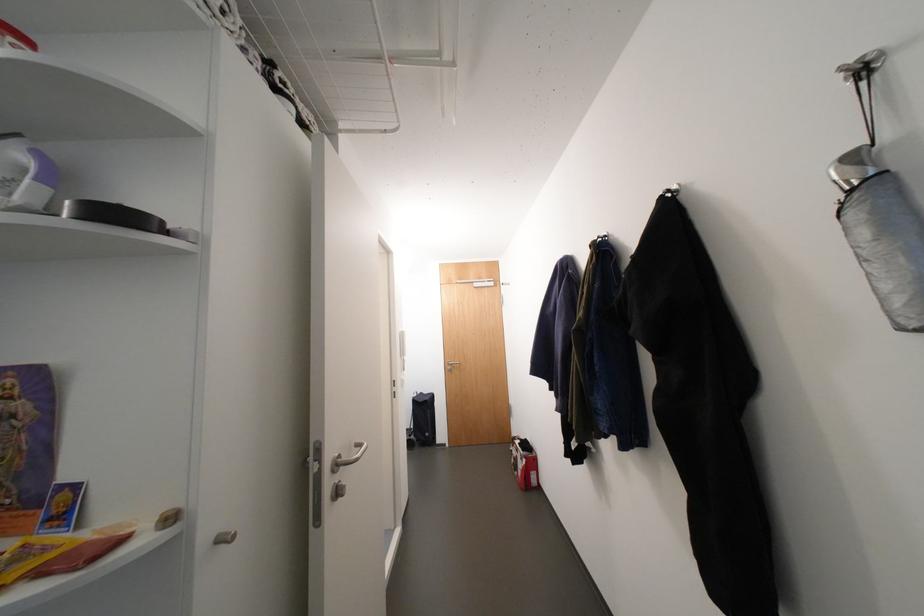
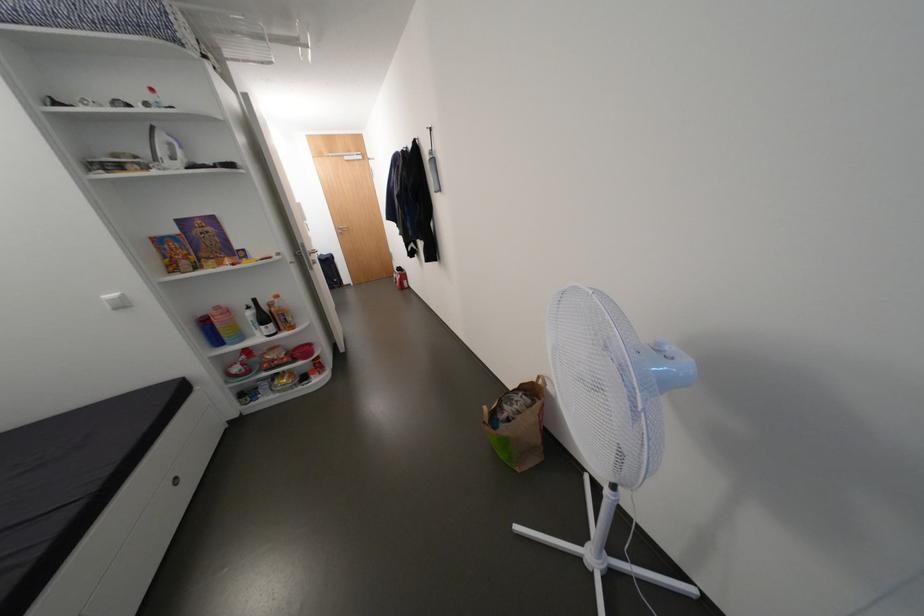
The point at (527, 445) is marked in the first image. Where is the corresponding point in the second image?

(405, 270)